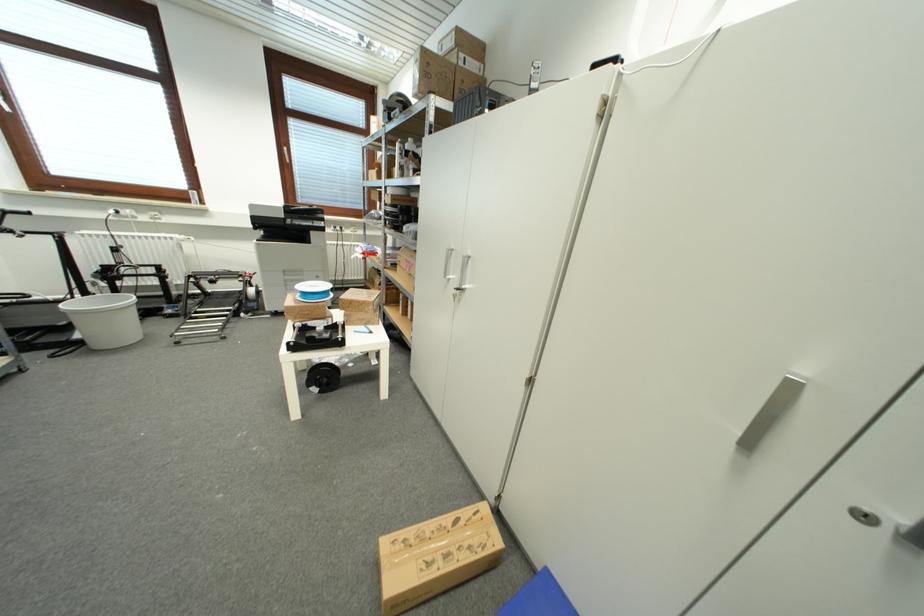
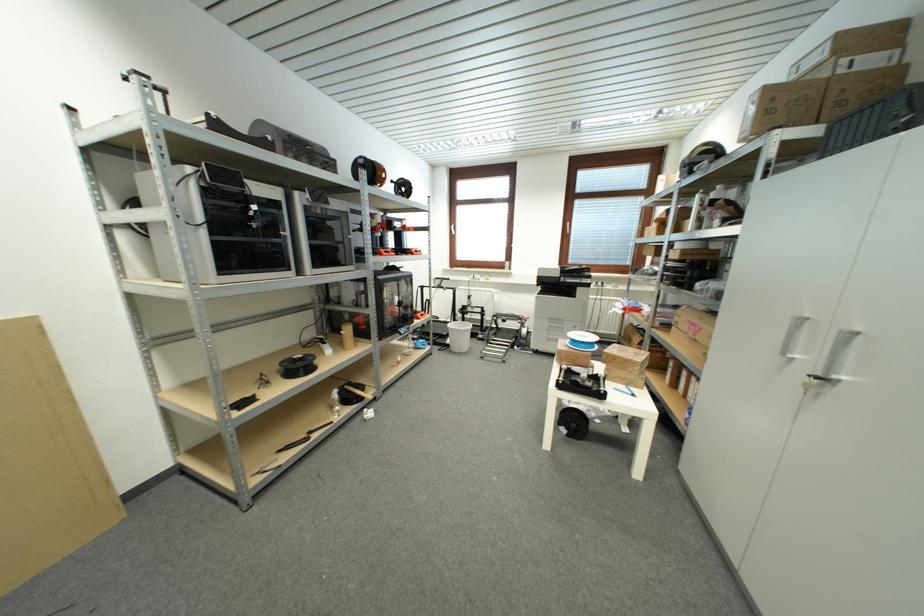
Find the pixel in the second image that matches point 422,57 in the first image.

(761, 99)